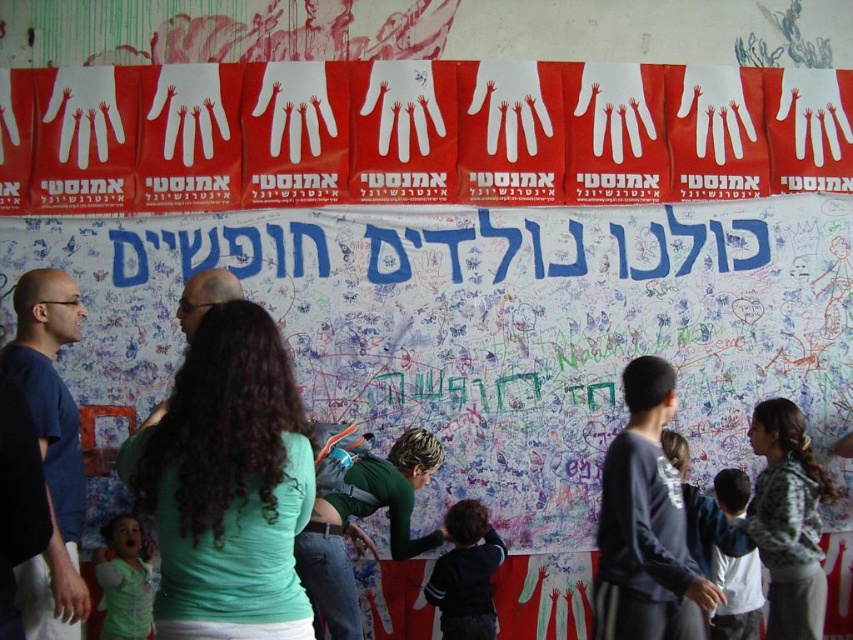
Is red paper banner at upper center above green matte shirt at center?

Yes, red paper banner at upper center is above green matte shirt at center.

The height and width of the screenshot is (640, 853). What are the coordinates of `red paper banner at upper center` in the screenshot? It's located at (415, 134).

Identify the location of red paper banner at upper center. (415, 134).

Looking at this image, does white paper banner at upper center appear under white cotton shirt at lower right?

Incorrect, white paper banner at upper center is not positioned below white cotton shirt at lower right.

Can you confirm if white paper banner at upper center is wider than white cotton shirt at lower right?

Yes.

Locate an element on the screen. Image resolution: width=853 pixels, height=640 pixels. white paper banner at upper center is located at coordinates (479, 248).

Can you confirm if white paper banner at upper center is thinner than blue shirt at left?

No, white paper banner at upper center is not thinner than blue shirt at left.

Locate an element on the screen. white paper banner at upper center is located at coordinates (479, 248).